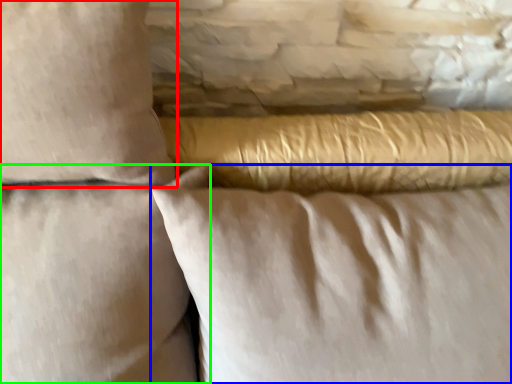
Question: Which is nearer to the pillow (highlighted by a red box)? pillow (highlighted by a blue box) or pillow (highlighted by a green box).

Choices:
 (A) pillow
 (B) pillow

Answer: (B)